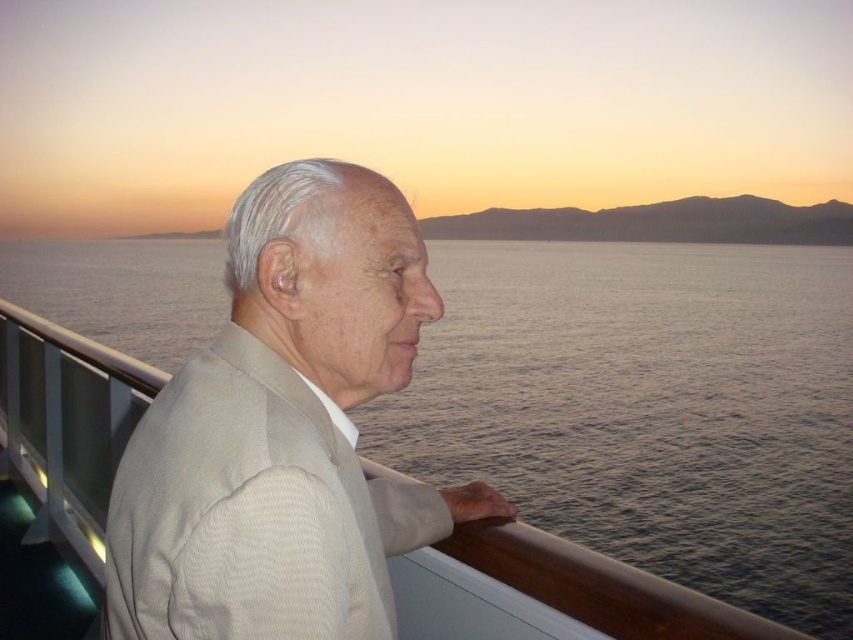
Describe the element at coordinates (651, 406) in the screenshot. I see `gray water at left` at that location.

Between gray water at left and beige textured suit at center, which one is positioned higher?

gray water at left is higher up.

Which is in front, point (164, 248) or point (218, 417)?

Point (218, 417) is in front.

The image size is (853, 640). I want to click on gray water at left, so click(x=651, y=406).